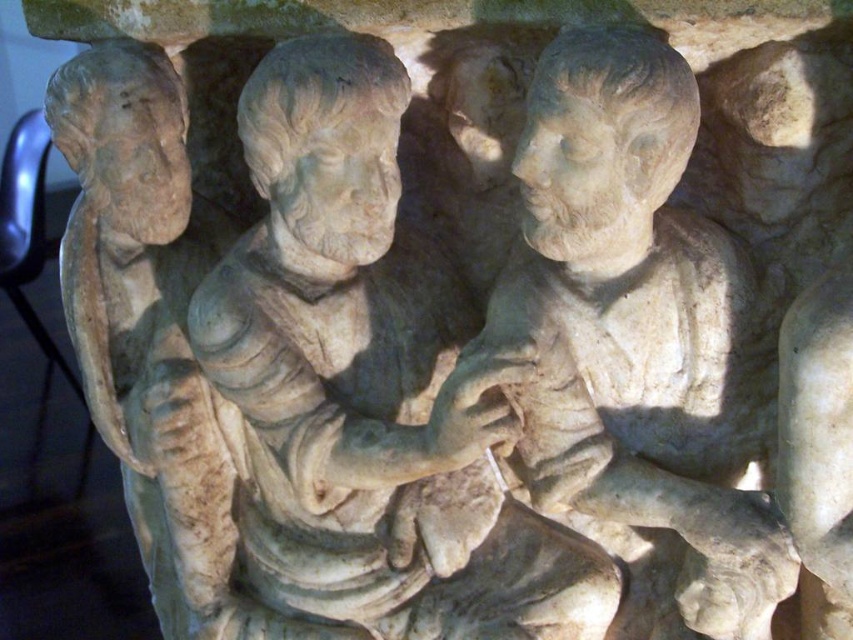
Question: Which of the following is the closest to the observer?

Choices:
 (A) (x=665, y=552)
 (B) (x=374, y=230)

Answer: (B)

Question: Among these objects, which one is nearest to the camera?

Choices:
 (A) white stone statue at center
 (B) white marble statue at center

Answer: (A)

Question: Does white marble statue at center have a greater width compared to white stone statue at center?

Choices:
 (A) no
 (B) yes

Answer: (B)

Question: Does white marble statue at center have a lesser width compared to white stone statue at center?

Choices:
 (A) yes
 (B) no

Answer: (B)

Question: Is white marble statue at center below white stone statue at center?

Choices:
 (A) yes
 (B) no

Answer: (A)

Question: Which of the following is the closest to the observer?

Choices:
 (A) (316, 337)
 (B) (672, 76)

Answer: (B)